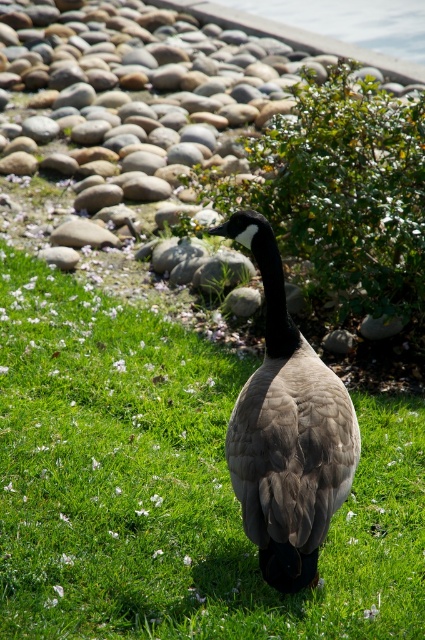
Question: Which point is farther to the camera?

Choices:
 (A) (x=102, y=573)
 (B) (x=326, y=506)

Answer: (A)

Question: Which of the following is the closest to the observer?

Choices:
 (A) (44, 541)
 (B) (291, 486)

Answer: (B)

Question: Can you confirm if green grass at center is positioned to the left of gray downy goose at center?

Choices:
 (A) no
 (B) yes

Answer: (B)

Question: Does green grass at center have a greater width compared to gray downy goose at center?

Choices:
 (A) yes
 (B) no

Answer: (A)

Question: Does green grass at center have a smaller size compared to gray downy goose at center?

Choices:
 (A) no
 (B) yes

Answer: (A)